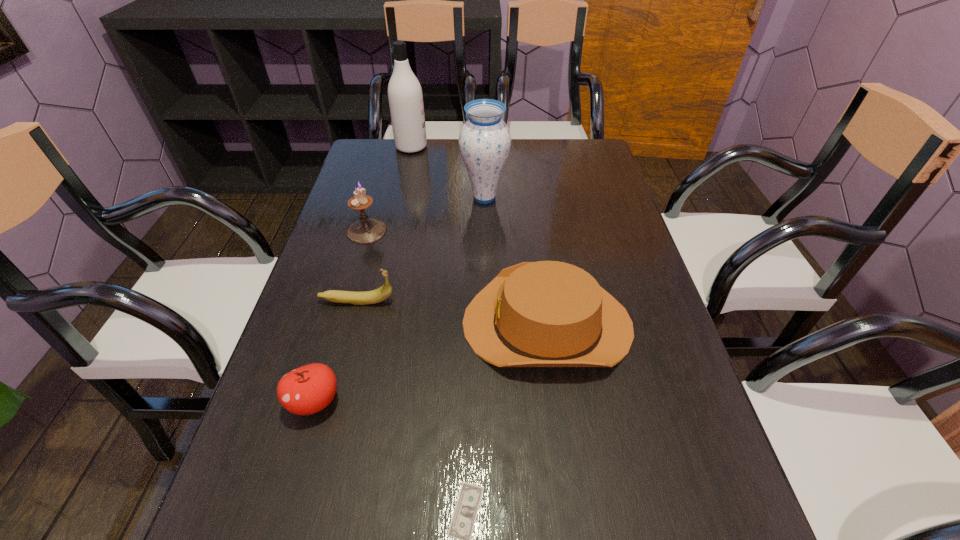
Find the location of a particular element. Image resolution: width=960 pixels, height=540 pixels. free region located 0.080m on the back of the vase is located at coordinates (484, 170).

Find the location of a particular element. The height and width of the screenshot is (540, 960). free space located 0.080m on the back of the candle holder is located at coordinates (375, 202).

Where is `vacant area situated 0.320m on the front-facing side of the cowboy hat`? vacant area situated 0.320m on the front-facing side of the cowboy hat is located at coordinates (317, 324).

Locate an element on the screen. This screenshot has width=960, height=540. vacant space situated 0.260m on the front-facing side of the cowboy hat is located at coordinates (344, 324).

Where is `vacant area situated 0.060m on the front-facing side of the cowboy hat`? This screenshot has height=540, width=960. vacant area situated 0.060m on the front-facing side of the cowboy hat is located at coordinates (435, 324).

You are a GUI agent. You are given a task and a screenshot of the screen. Output one action in this format:
    pyautogui.click(x=<x>, y=<y>)
    Task: Click on the free space located at the stem of the banana
    
    Given the screenshot: What is the action you would take?
    pyautogui.click(x=508, y=301)

I want to click on vacant space located on the right of the sixth farthest object, so click(527, 401).

Identify the location of object at the far edge. The height and width of the screenshot is (540, 960). (405, 96).

This screenshot has height=540, width=960. In order to click on shampoo that is at the left edge in this screenshot , I will do `click(405, 96)`.

Where is `candle holder that is at the left edge`? The width and height of the screenshot is (960, 540). candle holder that is at the left edge is located at coordinates (366, 230).